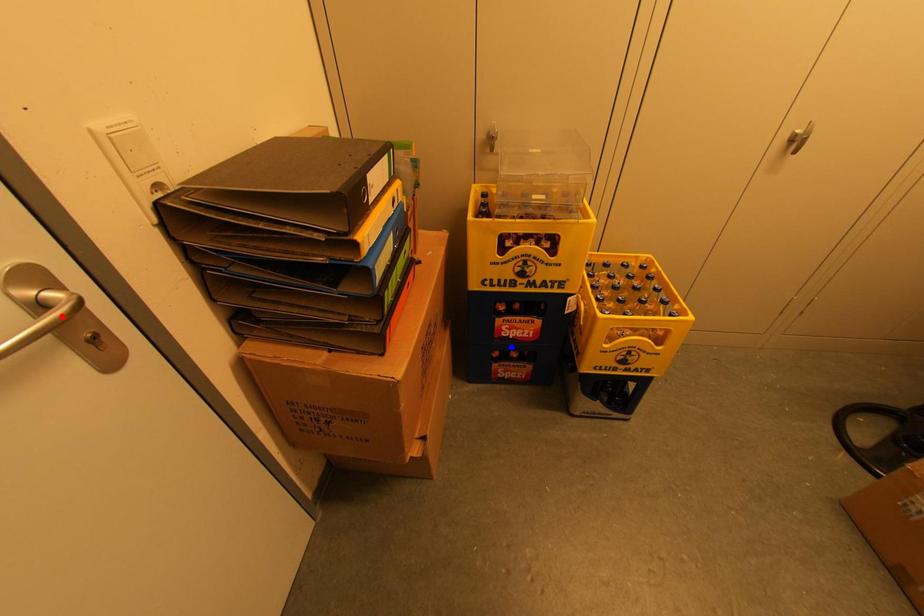
Question: Which of the two points in the image is closer to the camera?

Choices:
 (A) Blue point is closer.
 (B) Red point is closer.

Answer: (B)